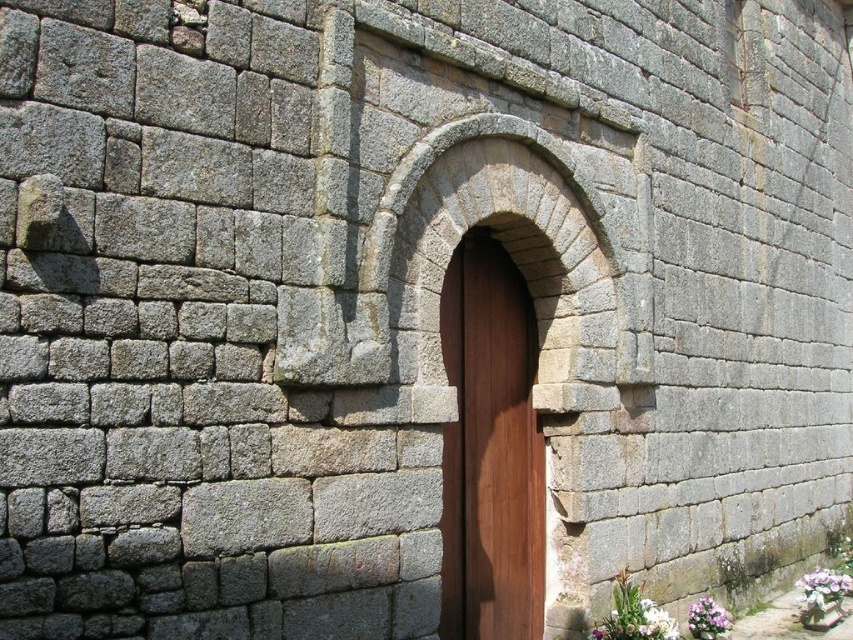
In the scene shown: Can you confirm if white matte flowers at lower right is taller than purple floral bouquet at lower right?

Yes, white matte flowers at lower right is taller than purple floral bouquet at lower right.

Which is below, white matte flowers at lower right or purple floral bouquet at lower right?

purple floral bouquet at lower right is below.

The height and width of the screenshot is (640, 853). What do you see at coordinates (633, 614) in the screenshot?
I see `white matte flowers at lower right` at bounding box center [633, 614].

Where is `white matte flowers at lower right`? Image resolution: width=853 pixels, height=640 pixels. white matte flowers at lower right is located at coordinates (633, 614).

Which of these two, brown wooden door at center or white matte flower at lower right, stands taller?

brown wooden door at center

Is point (511, 580) more distant than point (653, 637)?

Yes.

You are a GUI agent. You are given a task and a screenshot of the screen. Output one action in this format:
    pyautogui.click(x=<x>, y=<y>)
    Task: Click on the brown wooden door at center
    This screenshot has height=640, width=853.
    Given the screenshot: What is the action you would take?
    pyautogui.click(x=490, y=451)

Based on the photo, is the position of purple floral bouquet at lower right more distant than that of white matte flower at lower right?

Yes, purple floral bouquet at lower right is further from the viewer.

Can you confirm if purple floral bouquet at lower right is positioned above white matte flower at lower right?

Incorrect, purple floral bouquet at lower right is not positioned above white matte flower at lower right.

Between point (805, 573) and point (666, 621), which one is positioned in front?

Point (666, 621)

Find the location of a particular element. The width and height of the screenshot is (853, 640). purple floral bouquet at lower right is located at coordinates (822, 588).